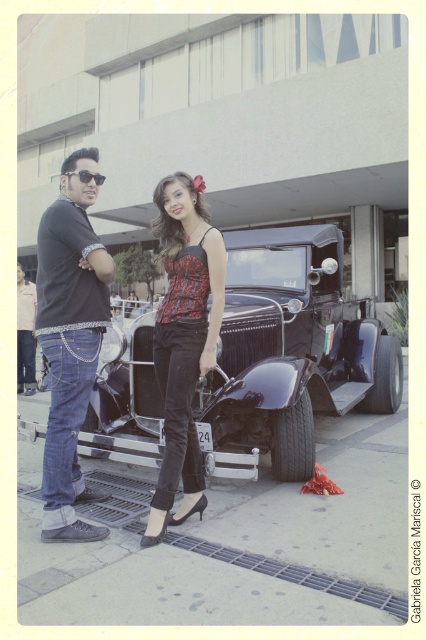
Question: From the image, what is the correct spatial relationship of shiny black car at center in relation to matte black shirt at center?

Choices:
 (A) below
 (B) above

Answer: (B)

Question: Which of these objects is positioned farthest from the matte black shirt at center?

Choices:
 (A) sunglasses at upper left
 (B) matte black top at center

Answer: (A)

Question: Based on their relative distances, which object is farther from the matte black top at center?

Choices:
 (A) denim jeans at left
 (B) shiny black car at center
 (C) matte black shirt at center

Answer: (B)

Question: Where is shiny black car at center located in relation to denim jeans at left in the image?

Choices:
 (A) left
 (B) right

Answer: (B)

Question: Estimate the real-world distances between objects in this image. Which object is closer to the denim jeans at left?

Choices:
 (A) matte black top at center
 (B) matte black shirt at center
 (C) sunglasses at upper left
 (D) shiny black car at center

Answer: (B)

Question: Can you confirm if shiny black car at center is bigger than matte black top at center?

Choices:
 (A) no
 (B) yes

Answer: (B)